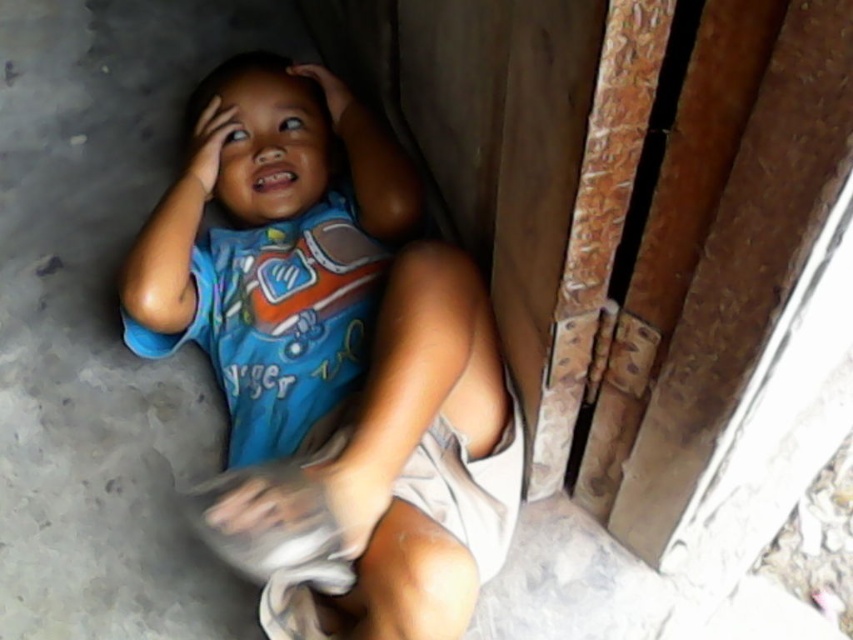
Does blue cotton shirt at center appear over blue fabric head at upper center?

Incorrect, blue cotton shirt at center is not positioned above blue fabric head at upper center.

How much distance is there between blue cotton shirt at center and blue fabric head at upper center?

The distance of blue cotton shirt at center from blue fabric head at upper center is 6.02 inches.

Where is `blue cotton shirt at center`? blue cotton shirt at center is located at coordinates (332, 362).

Where is `blue cotton shirt at center`? This screenshot has height=640, width=853. blue cotton shirt at center is located at coordinates (332, 362).